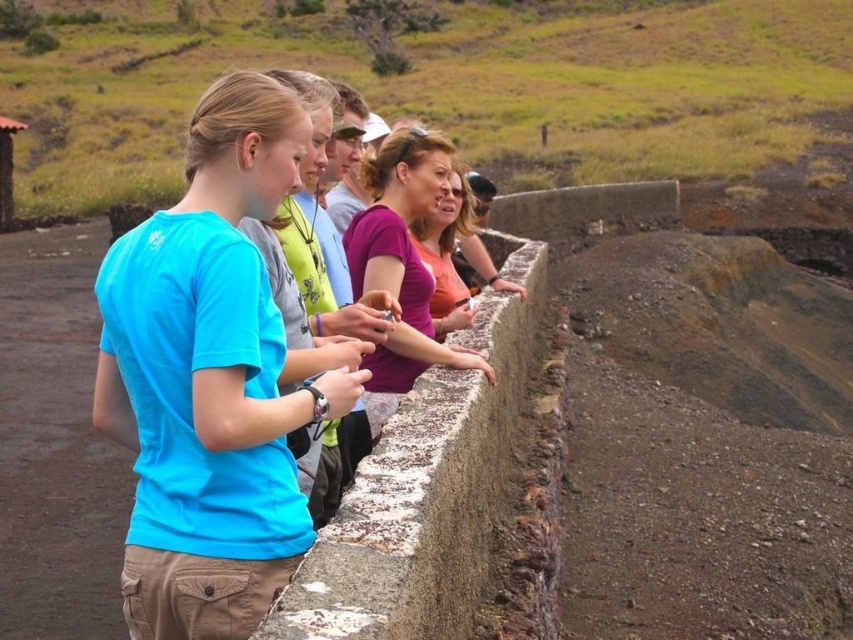
Does rusty concrete barrier at center come behind matte blue shirt at center?

No, rusty concrete barrier at center is in front of matte blue shirt at center.

Who is shorter, rusty concrete barrier at center or matte blue shirt at center?

matte blue shirt at center

Locate an element on the screen. Image resolution: width=853 pixels, height=640 pixels. rusty concrete barrier at center is located at coordinates (425, 490).

Locate an element on the screen. rusty concrete barrier at center is located at coordinates (425, 490).

Can you confirm if matte blue t-shirt at center is taller than matte blue shirt at center?

Yes, matte blue t-shirt at center is taller than matte blue shirt at center.

How much distance is there between matte blue t-shirt at center and matte blue shirt at center?

matte blue t-shirt at center and matte blue shirt at center are 1.03 meters apart from each other.

Who is more distant from viewer, [167,314] or [326,433]?

The point [326,433] is behind.

Identify the location of matte blue t-shirt at center. (210, 378).

Between point (387, 209) and point (289, 256), which one is positioned in front?

Point (289, 256) is more forward.

Between point (422, 276) and point (335, 488), which one is positioned in front?

Positioned in front is point (335, 488).

The height and width of the screenshot is (640, 853). In order to click on purple matte shirt at center in this screenshot , I will do `click(401, 264)`.